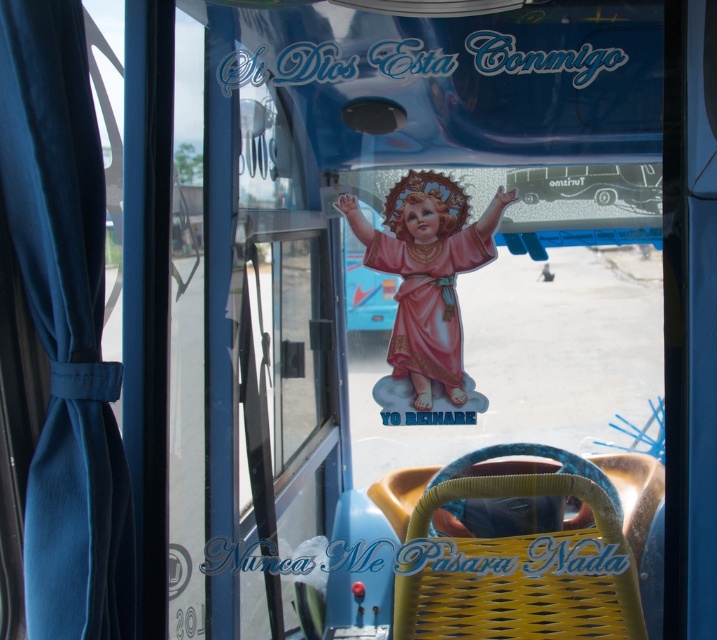
Measure the distance between yellow woven basket at lower center and matte pink doll at center.

yellow woven basket at lower center is 12.12 inches away from matte pink doll at center.

Locate an element on the screen. The image size is (717, 640). yellow woven basket at lower center is located at coordinates (517, 568).

Where is `yellow woven basket at lower center`? yellow woven basket at lower center is located at coordinates click(517, 568).

Which of these two, teal fabric curtain at left or matte pink doll at center, stands shorter?

With less height is matte pink doll at center.

Is the position of teal fabric curtain at left more distant than that of matte pink doll at center?

That is False.

Where is `teal fabric curtain at left`? teal fabric curtain at left is located at coordinates (65, 326).

Is teal fabric curtain at left bigger than yellow woven basket at lower center?

Yes.

Based on the photo, does teal fabric curtain at left appear on the left side of yellow woven basket at lower center?

Yes, teal fabric curtain at left is to the left of yellow woven basket at lower center.

This screenshot has height=640, width=717. Identify the location of teal fabric curtain at left. (65, 326).